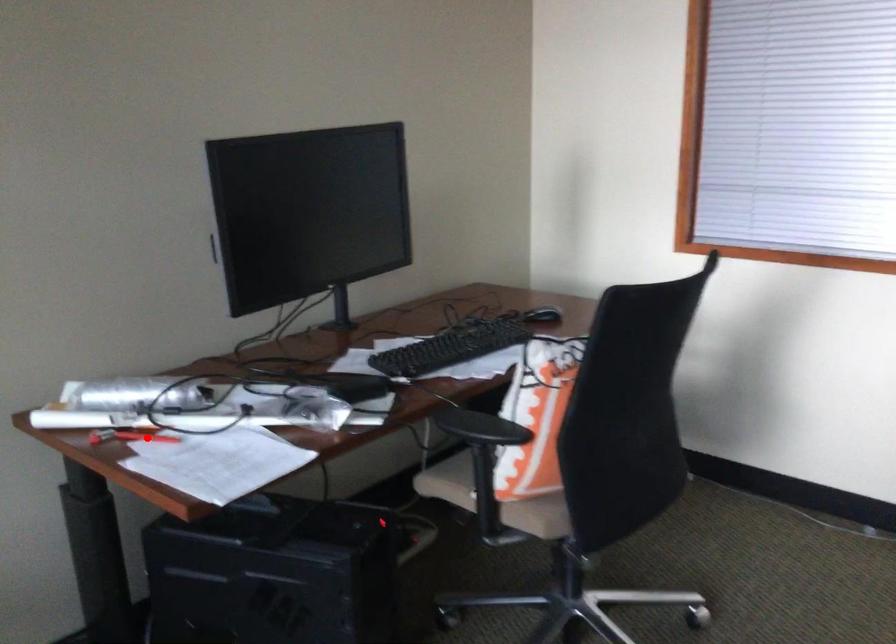
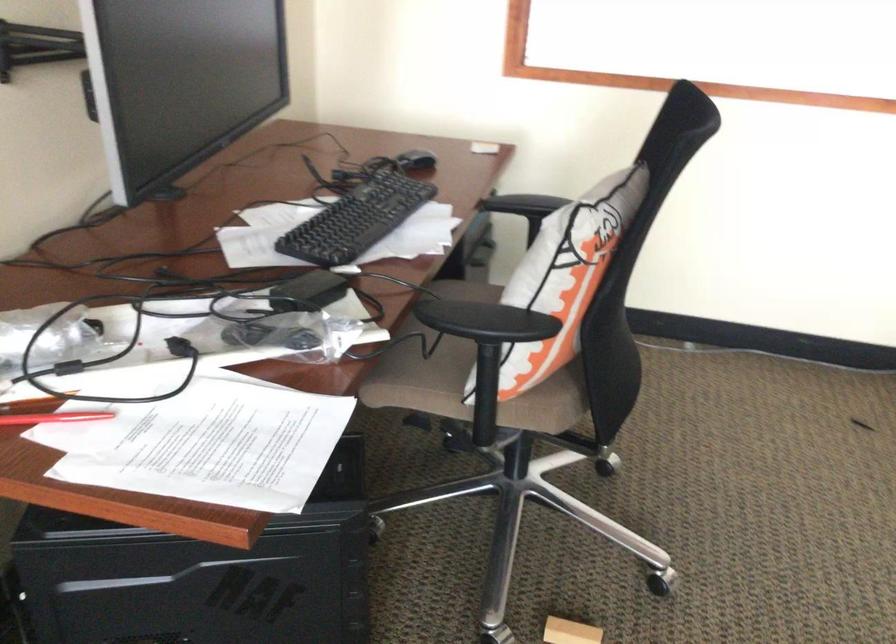
Find the pixel in the second image that matches the highlighted location in the first image.

(54, 418)